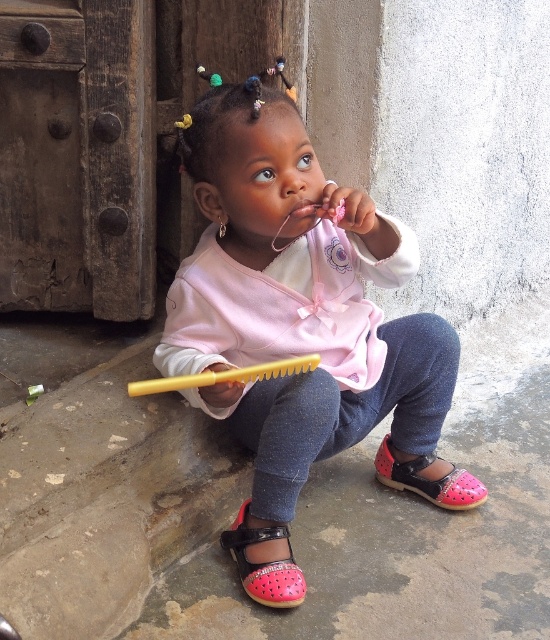
You are a parent trying to decide whether to let your child play with the pink fabric at center and the yellow plastic brush at lower center. Considering their sizes, which one is taller?

The pink fabric at center is taller than the yellow plastic brush at lower center.

You are a delivery person trying to place a small package between the pink fabric at center and the yellow plastic brush at lower center. The package is 9 inches long. Can you fit it between them?

The pink fabric at center and yellow plastic brush at lower center are 8.53 inches apart. Since the package is 9 inches long, it cannot fit between them as the distance is shorter than the package length.